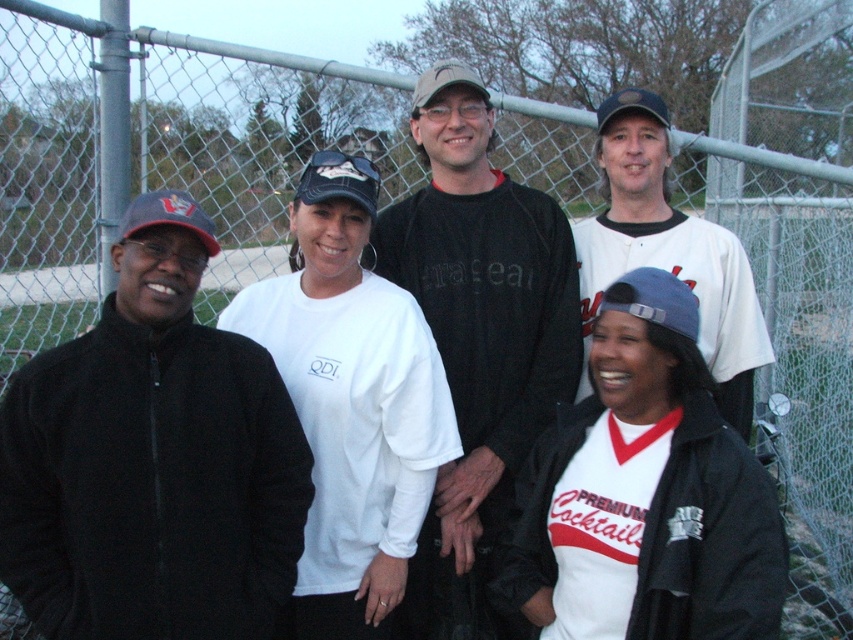
You are a photographer setting up for a group photo. You have a camera with a 50mm lens and need to ensure all subjects are in focus. The depth of field at this lens setting allows sharpness within a 1.5 meters range. Can you capture both the black fleece jacket at left and the camouflage fabric baseball cap at center clearly in the same photo?

The distance between the black fleece jacket at left and the camouflage fabric baseball cap at center is 1.54 meters. Since the depth of field allows for sharpness within a 1.5 meters range, the 1.54 meters distance exceeds this limit. Therefore, it might be challenging to keep both in focus simultaneously. Consider adjusting the aperture for a larger depth of field or moving the subjects closer together.